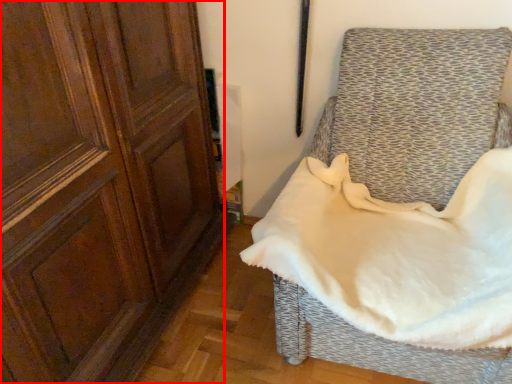
Question: Observing the image, what is the correct spatial positioning of screen door (annotated by the red box) in reference to furniture?

Choices:
 (A) left
 (B) right

Answer: (A)